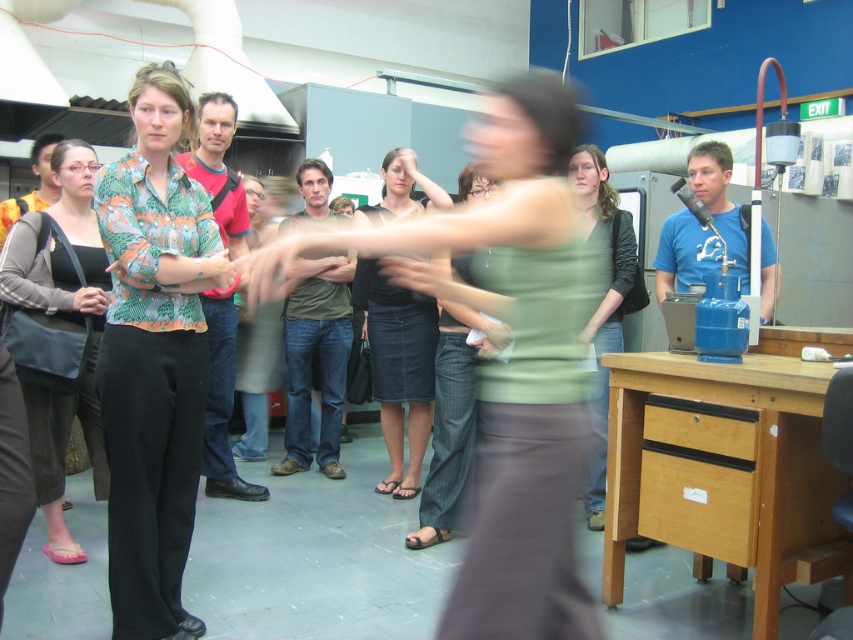
Does green matte tank top at center have a greater width compared to denim skirt at center?

Yes, green matte tank top at center is wider than denim skirt at center.

Can you confirm if green matte tank top at center is thinner than denim skirt at center?

Incorrect, green matte tank top at center's width is not less than denim skirt at center's.

Does point (572, 259) lie in front of point (389, 419)?

Yes, point (572, 259) is in front of point (389, 419).

Locate an element on the screen. green matte tank top at center is located at coordinates 509,358.

This screenshot has width=853, height=640. In order to click on green matte tank top at center in this screenshot , I will do `click(509, 358)`.

Is green matte tank top at center bigger than green matte shirt at center?

Correct, green matte tank top at center is larger in size than green matte shirt at center.

Is point (482, 148) more distant than point (604, 385)?

No, it is in front of (604, 385).

The width and height of the screenshot is (853, 640). What are the coordinates of `green matte tank top at center` in the screenshot? It's located at click(x=509, y=358).

From the picture: Is the position of matte black tank top at center less distant than that of denim skirt at center?

Yes, matte black tank top at center is in front of denim skirt at center.

Is matte black tank top at center below denim skirt at center?

Correct, matte black tank top at center is located below denim skirt at center.

Describe the element at coordinates (57, 330) in the screenshot. I see `matte black tank top at center` at that location.

Identify the location of matte black tank top at center. (57, 330).